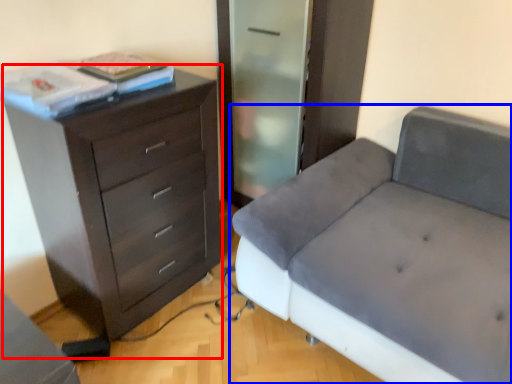
Question: Which point is closer to the camera, chest of drawers (highlighted by a red box) or studio couch (highlighted by a blue box)?

Choices:
 (A) chest of drawers
 (B) studio couch

Answer: (B)